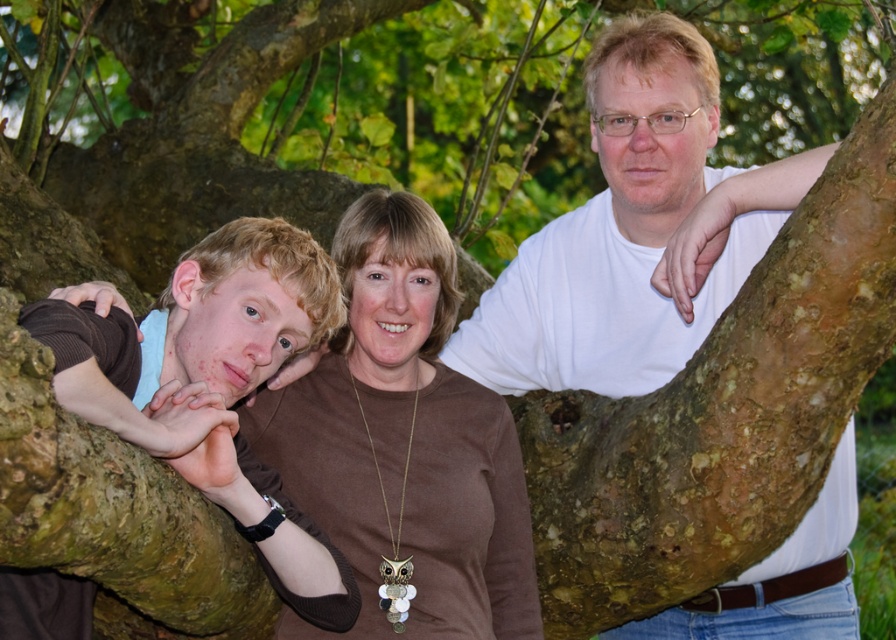
Question: Which point is closer to the camera?

Choices:
 (A) (220, 433)
 (B) (777, 557)
 (C) (451, 563)

Answer: (A)

Question: Which of the following is the farthest from the observer?

Choices:
 (A) (420, 472)
 (B) (227, 262)
 (C) (623, 234)

Answer: (C)

Question: Observing the image, what is the correct spatial positioning of brown matte necklace at center in reference to brown matte shirt at left?

Choices:
 (A) above
 (B) below

Answer: (B)

Question: Which point is farther to the camera?

Choices:
 (A) brown matte necklace at center
 (B) white matte shirt at upper center
 (C) brown matte shirt at left

Answer: (A)

Question: Is white matte shirt at upper center wider than brown matte necklace at center?

Choices:
 (A) yes
 (B) no

Answer: (A)

Question: Observing the image, what is the correct spatial positioning of white matte shirt at upper center in reference to brown matte necklace at center?

Choices:
 (A) below
 (B) above

Answer: (B)